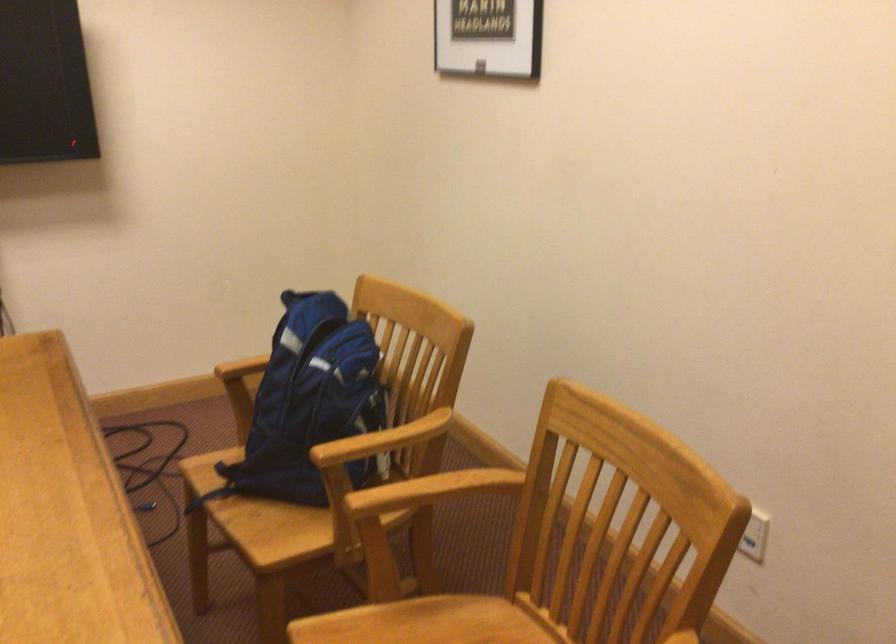
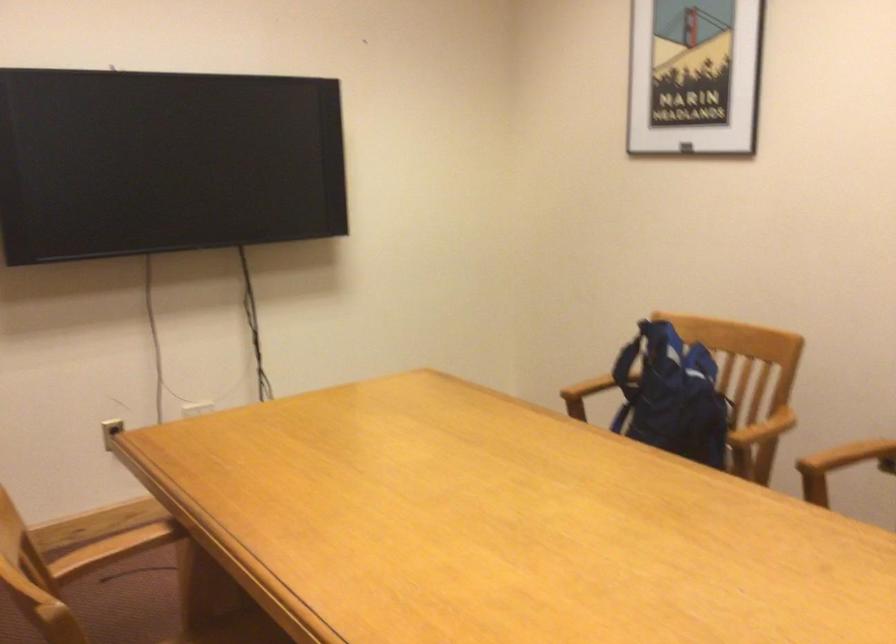
Where in the second image is the point corresponding to the point at 400,438 from the first image?

(763, 428)